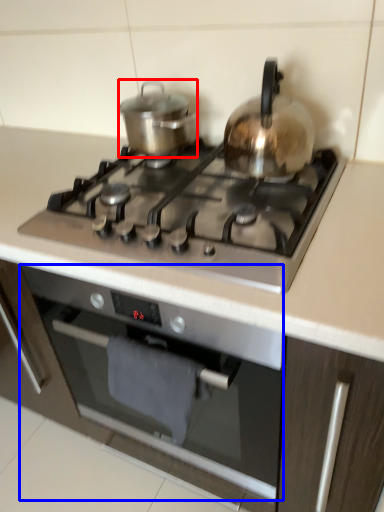
Question: Which object appears farthest to the camera in this image, kitchen appliance (highlighted by a red box) or oven (highlighted by a blue box)?

Choices:
 (A) kitchen appliance
 (B) oven

Answer: (A)